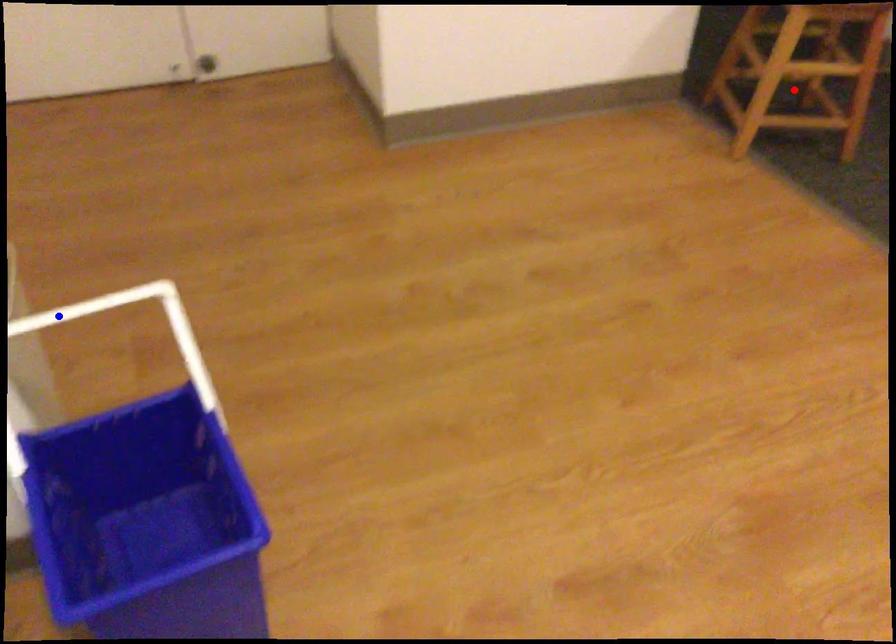
Question: Which of the two points in the image is closer to the camera?

Choices:
 (A) Blue point is closer.
 (B) Red point is closer.

Answer: (A)